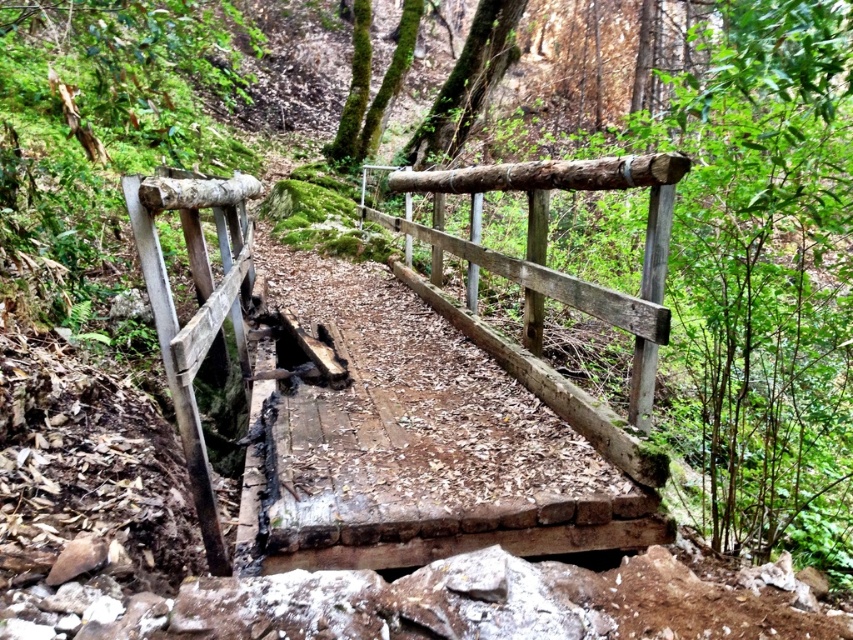
Question: Can you confirm if weathered wood bridge at center is thinner than natural wood rail at center?

Choices:
 (A) yes
 (B) no

Answer: (B)

Question: Which of the following is the farthest from the observer?

Choices:
 (A) (630, 403)
 (B) (312, 410)

Answer: (A)

Question: Can you confirm if weathered wood bridge at center is wider than natural wood rail at center?

Choices:
 (A) no
 (B) yes

Answer: (B)

Question: Which point is closer to the camera?

Choices:
 (A) natural wood rail at center
 (B) weathered wood bridge at center

Answer: (B)

Question: Does weathered wood bridge at center appear on the left side of natural wood rail at center?

Choices:
 (A) yes
 (B) no

Answer: (A)